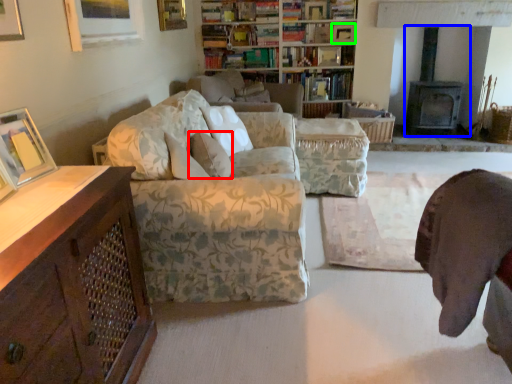
Question: Which object is positioned closest to pillow (highlighted by a red box)? Select from fireplace (highlighted by a blue box) and picture frame (highlighted by a green box).

Choices:
 (A) fireplace
 (B) picture frame

Answer: (B)